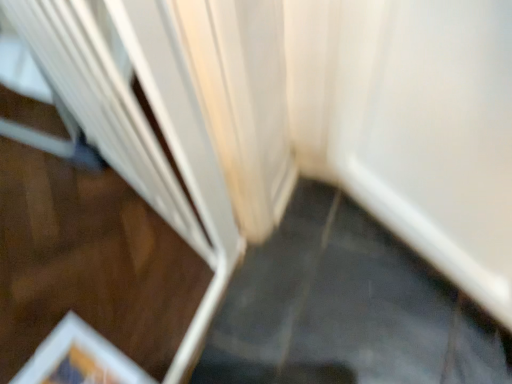
This screenshot has width=512, height=384. Describe the element at coordinates (141, 125) in the screenshot. I see `white plastic screen door at left` at that location.

I want to click on white plastic screen door at left, so click(x=141, y=125).

Where is `white plastic screen door at left`? The width and height of the screenshot is (512, 384). white plastic screen door at left is located at coordinates (141, 125).